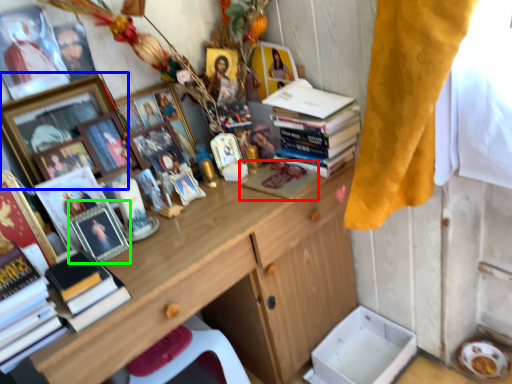
Question: Based on their relative distances, which object is nearer to magazine (highlighted by a red box)? Choose from picture frame (highlighted by a blue box) and picture frame (highlighted by a green box).

Choices:
 (A) picture frame
 (B) picture frame

Answer: (B)